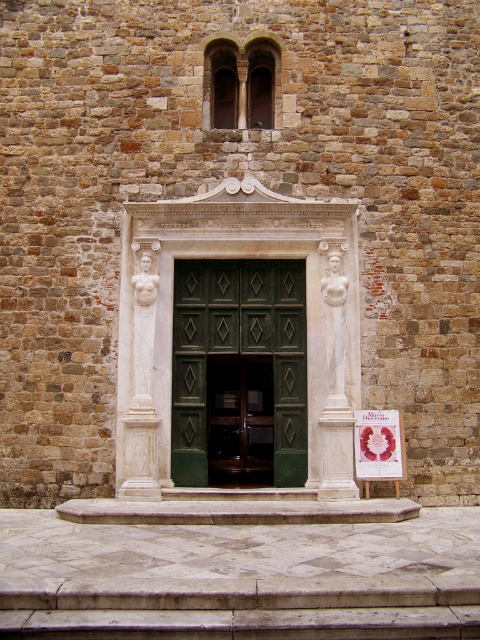
Does green wooden door at center have a lesser height compared to matte pink paper at center?

No, green wooden door at center is not shorter than matte pink paper at center.

Between point (228, 472) and point (399, 464), which one is positioned in front?

Point (399, 464)

Locate an element on the screen. This screenshot has width=480, height=640. green wooden door at center is located at coordinates (239, 356).

Is white marble statue at center below matte pink paper at center?

Incorrect, white marble statue at center is not positioned below matte pink paper at center.

In the scene shown: Is white marble statue at center positioned before matte pink paper at center?

Yes, white marble statue at center is in front of matte pink paper at center.

Where is `white marble statue at center`? This screenshot has width=480, height=640. white marble statue at center is located at coordinates (142, 380).

Locate an element on the screen. This screenshot has height=640, width=480. white marble statue at center is located at coordinates (142, 380).

Consider the image. Which of these two, green wooden door at center or white marble statue at center, stands shorter?

Standing shorter between the two is green wooden door at center.

Where is `green wooden door at center`? This screenshot has height=640, width=480. green wooden door at center is located at coordinates (239, 356).

Is point (194, 460) behind point (134, 444)?

Yes.

Find the location of a particular element. The width and height of the screenshot is (480, 640). green wooden door at center is located at coordinates (239, 356).